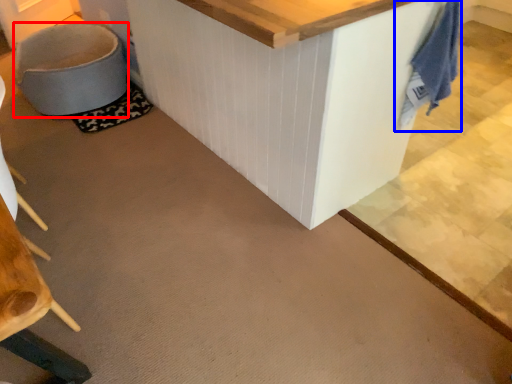
Question: Which point is closer to the camera, swivel chair (highlighted by a red box) or laundry (highlighted by a blue box)?

Choices:
 (A) swivel chair
 (B) laundry

Answer: (B)